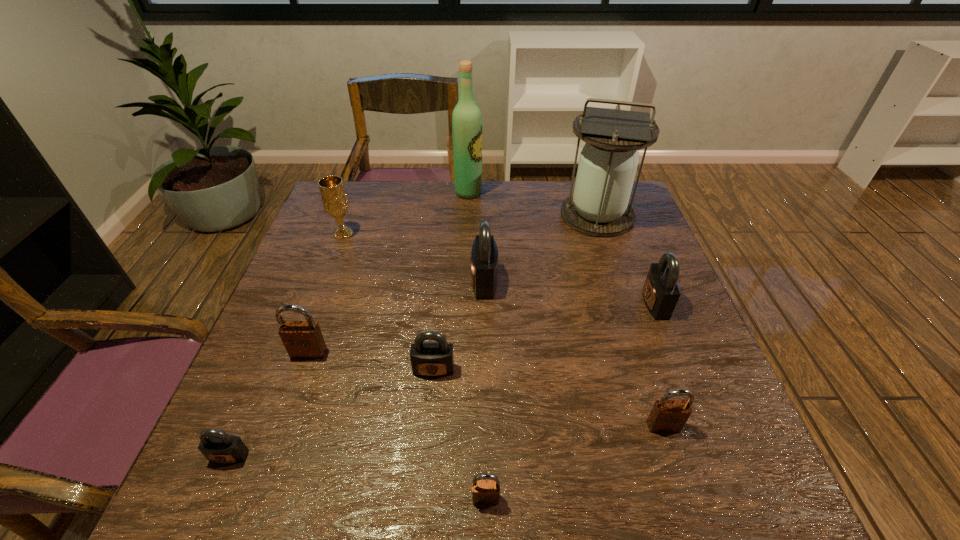
The height and width of the screenshot is (540, 960). I want to click on vacant space that is in between the nearest object and the rightmost padlock, so click(570, 401).

The image size is (960, 540). In order to click on free space between the biggest brown padlock and the wine bottle in this screenshot , I will do `click(389, 273)`.

Locate an element on the screen. free space between the tallest padlock and the fifth nearest padlock is located at coordinates [x=396, y=318].

Locate an element on the screen. free space between the second biggest brown padlock and the rightmost gray padlock is located at coordinates (660, 365).

You are a GUI agent. You are given a task and a screenshot of the screen. Output one action in this format:
    pyautogui.click(x=<x>, y=<y>)
    Task: Click on the free spot between the wine bottle and the leftmost gray padlock
    This screenshot has height=540, width=960.
    Given the screenshot: What is the action you would take?
    pyautogui.click(x=348, y=325)

At what (x,y) coordinates should I click in order to perform the action: click on vacant area between the third padlock from left to right and the second padlock from right to left. Please return your answer as a coordinate pair (x, y). Looking at the image, I should click on (548, 398).

Where is `vacant area that lies between the nearest object and the sixth padlock from right to left`? vacant area that lies between the nearest object and the sixth padlock from right to left is located at coordinates (397, 426).

Where is `empty location between the third smallest gray padlock and the ninth shortest object`? empty location between the third smallest gray padlock and the ninth shortest object is located at coordinates (626, 260).

This screenshot has width=960, height=540. I want to click on blank region between the third smallest gray padlock and the white wine bottle, so click(562, 248).

Where is `free space between the leftmost padlock and the nearest object`? Image resolution: width=960 pixels, height=540 pixels. free space between the leftmost padlock and the nearest object is located at coordinates (357, 477).